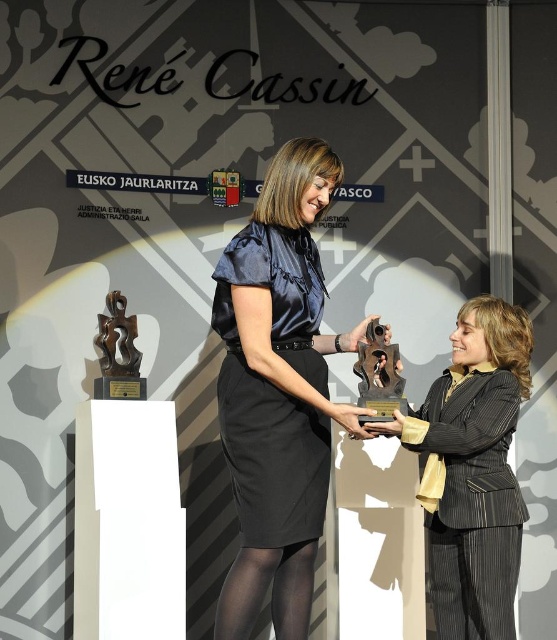
Question: Is the position of satin black dress at center less distant than that of matte gold trophy at center?

Choices:
 (A) yes
 (B) no

Answer: (A)

Question: Can you confirm if satin black dress at center is wider than matte gold trophy at center?

Choices:
 (A) no
 (B) yes

Answer: (A)

Question: Which object appears farthest from the camera in this image?

Choices:
 (A) matte gold trophy at center
 (B) satin black dress at center

Answer: (A)

Question: Which point is farther to the camera?

Choices:
 (A) (504, 614)
 (B) (266, 435)

Answer: (A)

Question: Does satin black dress at center appear on the left side of matte gold trophy at center?

Choices:
 (A) no
 (B) yes

Answer: (B)